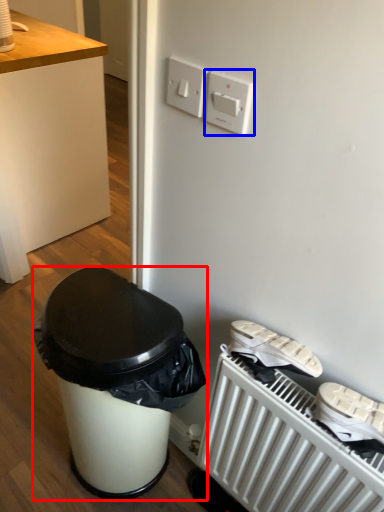
Question: Among these objects, which one is farthest to the camera, waste container (highlighted by a red box) or light switch (highlighted by a blue box)?

Choices:
 (A) waste container
 (B) light switch

Answer: (A)